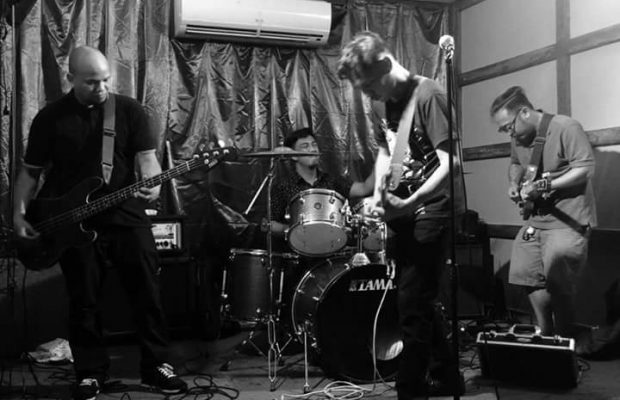
Identify the location of curtain. Image resolution: width=620 pixels, height=400 pixels. (250, 71).